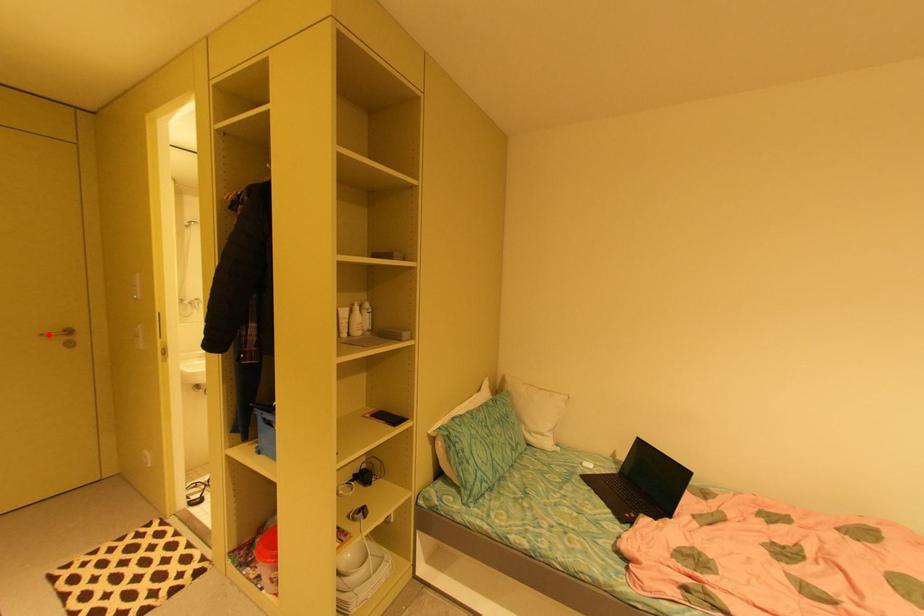
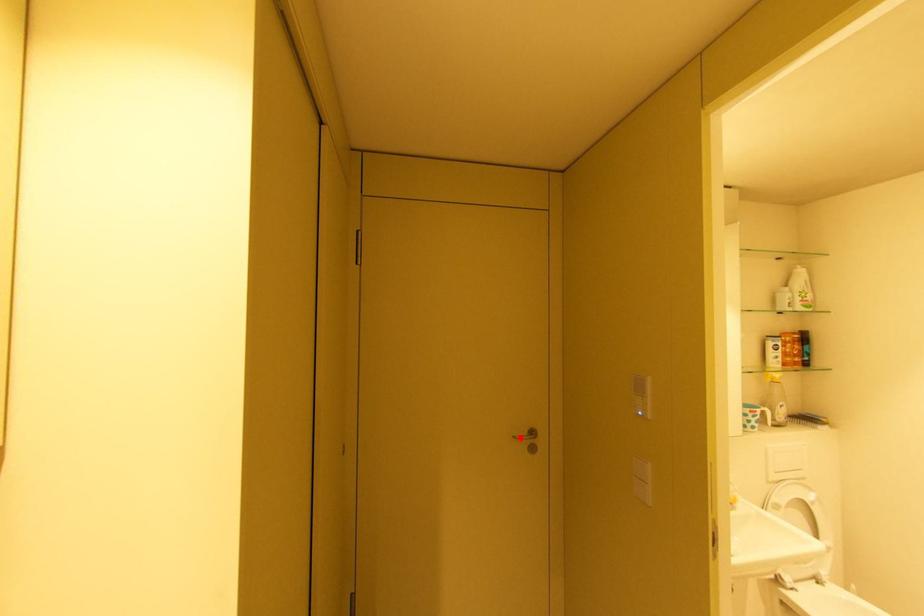
I am providing you with two images of the same scene from different viewpoints. A red point is marked on the first image and another point is marked on the second image. Does the point marked in image1 correspond to the same location as the one in image2?

Yes